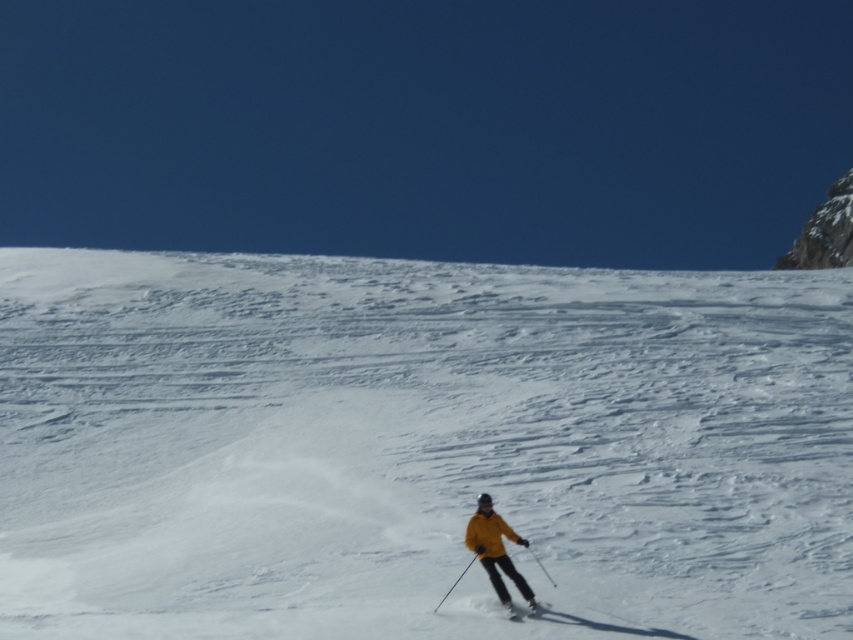
You are a drone operator trying to locate a skier wearing a yellow matte jacket at center in a snowy mountain landscape. Your GPS coordinates show that the skier is at point [495,550]. Can you confirm if this point is on the skier?

Yes, the point [495,550] is on the yellow matte jacket at center, so the GPS coordinates correctly indicate the skier.

Looking at this image, you are a drone operator trying to capture a photo of the skier and the rocky outcrop. The skier is at point (357, 268) and the rocky outcrop is at point (514, 620). Which point should you focus on first to ensure both are in the frame?

You should focus on point (357, 268) first because it is closer to the camera than point (514, 620), ensuring both are in the frame.